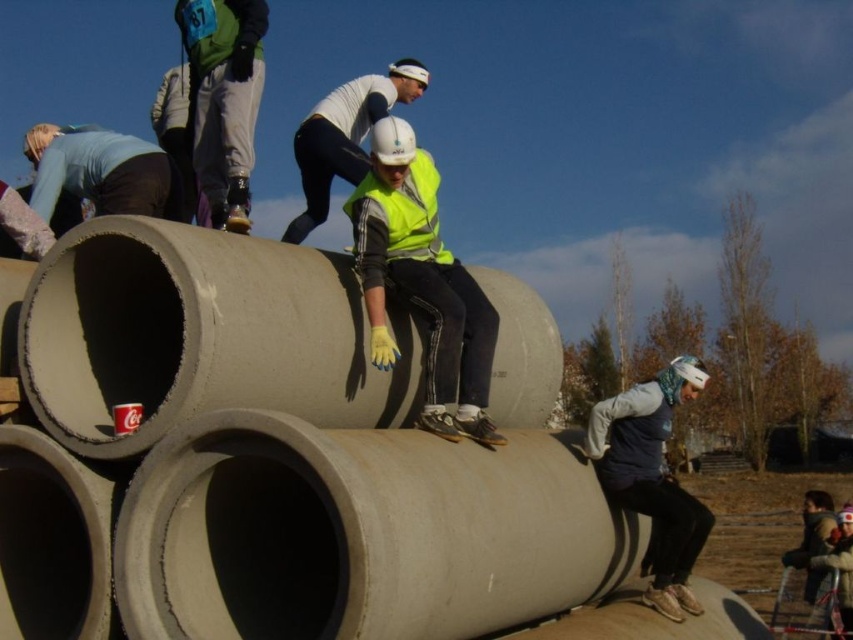
Question: Considering the real-world distances, which object is closest to the yellow reflective vest at center?

Choices:
 (A) green fabric bib at upper left
 (B) yellow reflective safety vest at center

Answer: (A)

Question: Can you confirm if concrete pipe at center is smaller than yellow reflective vest at center?

Choices:
 (A) no
 (B) yes

Answer: (B)

Question: In this image, where is dark gray fabric beanie at lower right located relative to green fabric bib at upper left?

Choices:
 (A) below
 (B) above

Answer: (A)

Question: Among these objects, which one is farthest from the camera?

Choices:
 (A) green fabric bib at upper left
 (B) concrete pipe at center
 (C) yellow reflective safety vest at center
 (D) dark gray fabric beanie at lower right

Answer: (D)

Question: Which object appears closest to the camera in this image?

Choices:
 (A) dark gray fabric beanie at lower right
 (B) yellow reflective vest at center

Answer: (A)

Question: Does concrete pipe at center come in front of yellow reflective vest at center?

Choices:
 (A) yes
 (B) no

Answer: (A)